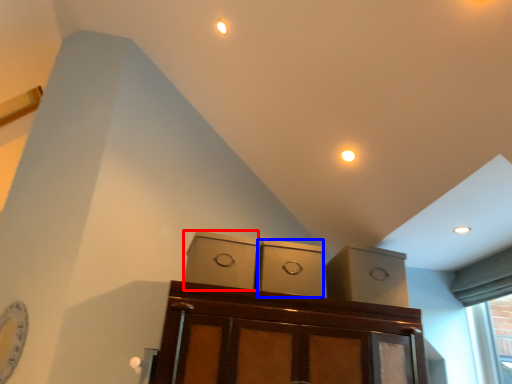
Question: Which object is further to the camera taking this photo, cabinetry (highlighted by a red box) or cabinetry (highlighted by a blue box)?

Choices:
 (A) cabinetry
 (B) cabinetry

Answer: (B)